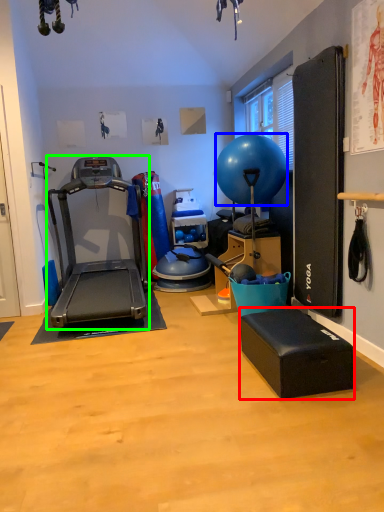
Question: Which object is the closest to the footrest (highlighted by a red box)? Choose among these: ball (highlighted by a blue box) or treadmill (highlighted by a green box).

Choices:
 (A) ball
 (B) treadmill

Answer: (A)